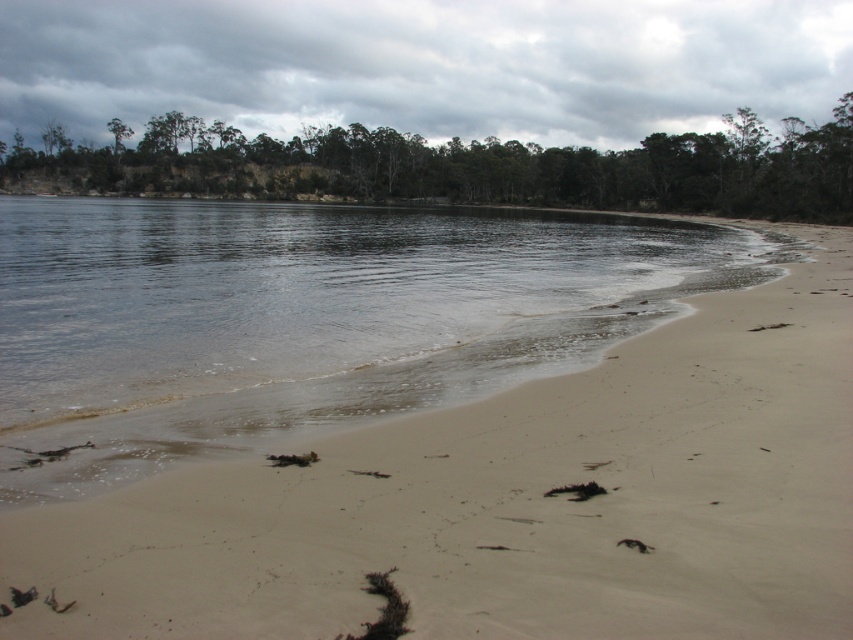
Question: Which of the following is the closest to the observer?

Choices:
 (A) light beige sand at lower right
 (B) clear water at center

Answer: (A)

Question: Can you confirm if clear water at center is bigger than green leafy trees at upper center?

Choices:
 (A) yes
 (B) no

Answer: (B)

Question: Does light beige sand at lower right appear on the left side of green leafy trees at upper center?

Choices:
 (A) no
 (B) yes

Answer: (A)

Question: Which point is farther from the camera taking this photo?

Choices:
 (A) (386, 154)
 (B) (456, 364)

Answer: (A)

Question: Which object appears closest to the camera in this image?

Choices:
 (A) light beige sand at lower right
 (B) green leafy trees at upper center
 (C) clear water at center

Answer: (A)

Question: Where is light beige sand at lower right located in relation to clear water at center in the image?

Choices:
 (A) below
 (B) above

Answer: (A)